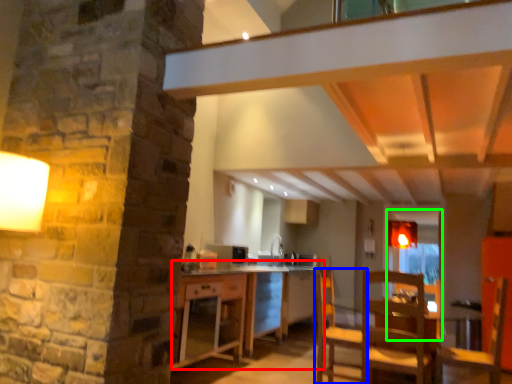
Question: Which is nearer to the table (highlighted by a red box)? chair (highlighted by a blue box) or glass door (highlighted by a green box).

Choices:
 (A) chair
 (B) glass door

Answer: (A)